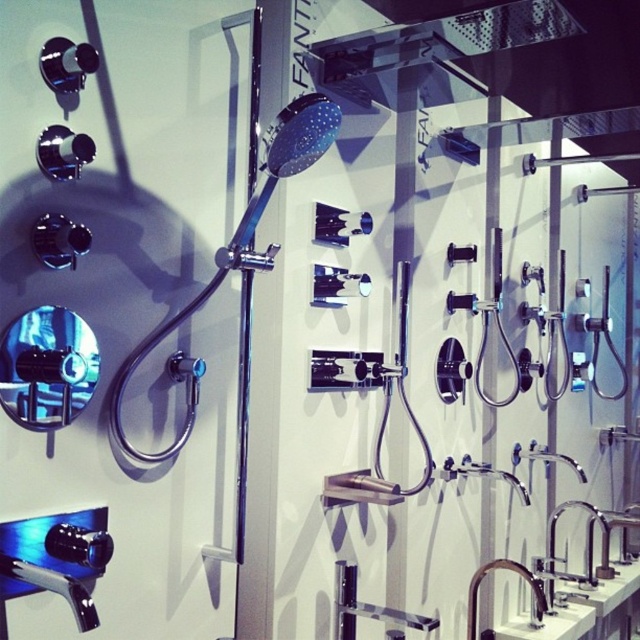
You are standing in front of the bathroom fixture display. You notice two points marked in the scene. Which point, point (256, 204) or point (568, 618), is closer to you?

Point (256, 204) is closer to you because it is in front of point (568, 618).